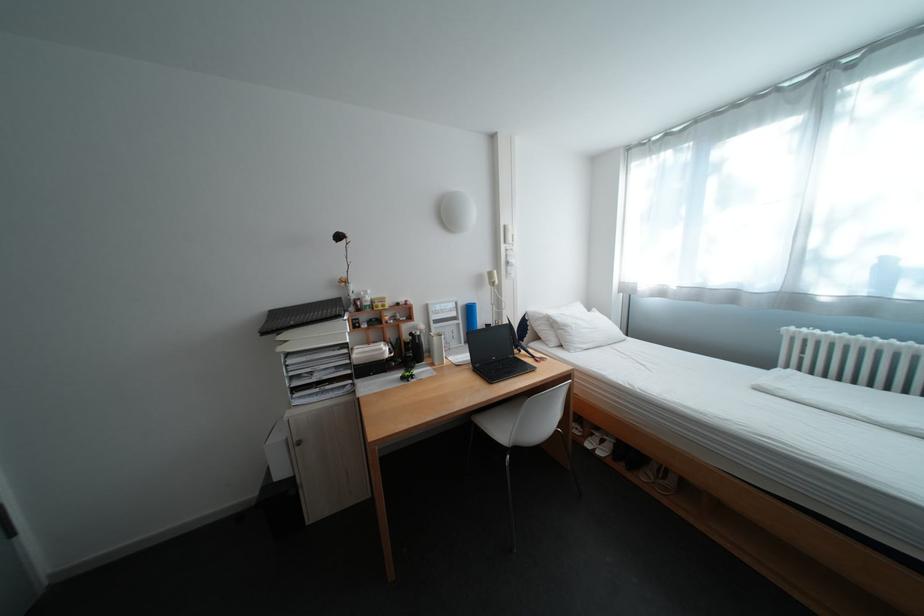
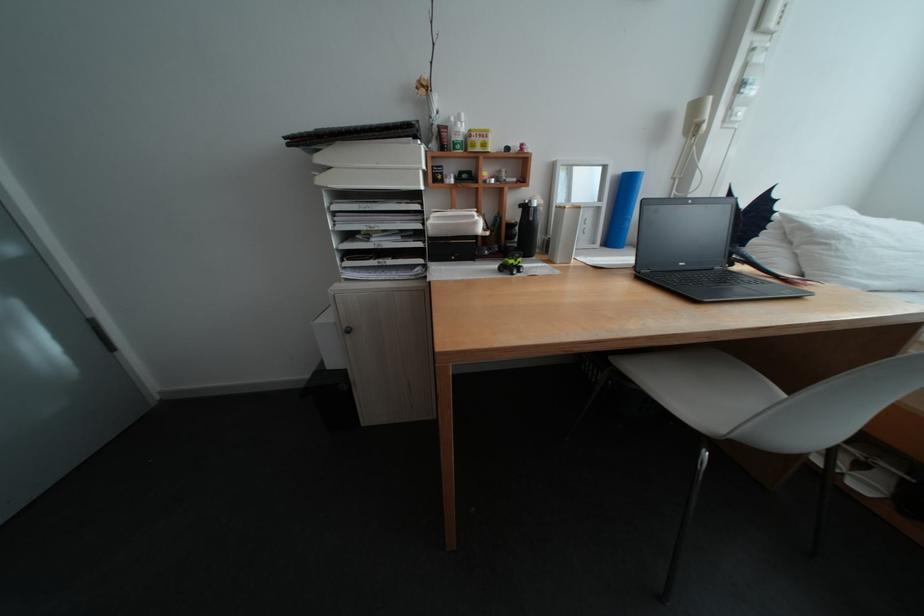
In the second image, find the point that corresponds to (294,339) in the first image.

(333, 160)